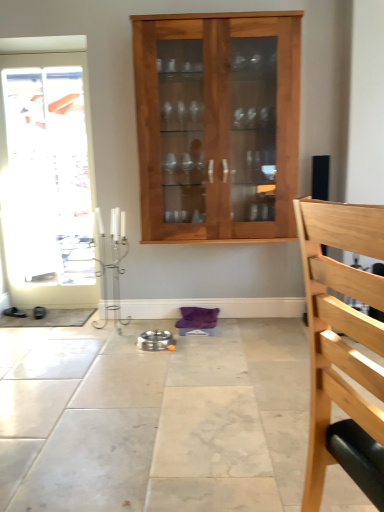
Where is `vacant space behind black leather shoes at lower left`? This screenshot has height=512, width=384. vacant space behind black leather shoes at lower left is located at coordinates (21, 312).